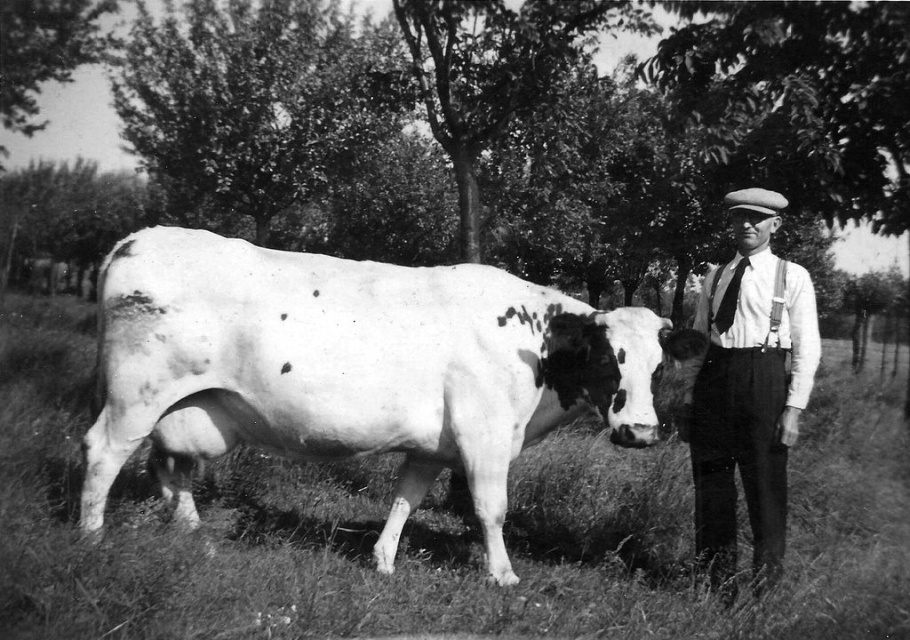
Question: Which point is farther to the camera?

Choices:
 (A) (762, 304)
 (B) (509, 460)

Answer: (B)

Question: Can you confirm if speckled white cow at center is positioned to the left of white striped shirt at right?

Choices:
 (A) yes
 (B) no

Answer: (A)

Question: Which point is farther to the camera?

Choices:
 (A) (195, 365)
 (B) (728, 394)

Answer: (B)

Question: Which point is closer to the camera?

Choices:
 (A) white striped shirt at right
 (B) speckled white cow at center

Answer: (B)

Question: Can you confirm if speckled white cow at center is positioned above white striped shirt at right?

Choices:
 (A) yes
 (B) no

Answer: (B)

Question: Is speckled white cow at center wider than white striped shirt at right?

Choices:
 (A) yes
 (B) no

Answer: (A)